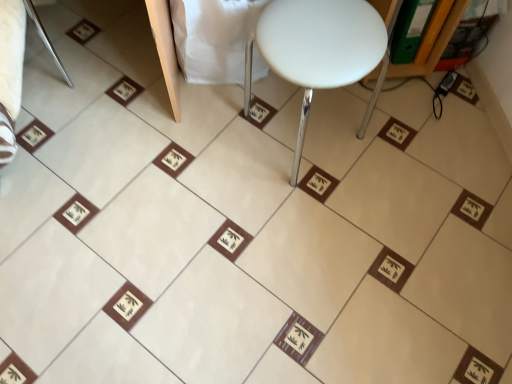
Where is `free point in front of white glossy stool at center`? This screenshot has width=512, height=384. free point in front of white glossy stool at center is located at coordinates (305, 231).